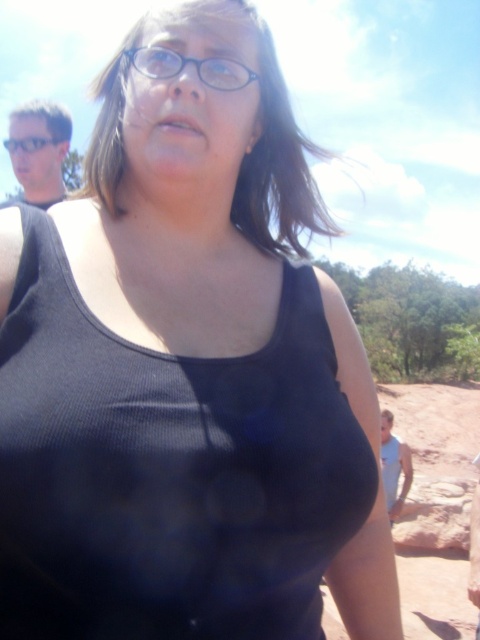
Question: Where is black plastic glasses at center located in relation to black plastic glasses at upper center in the image?

Choices:
 (A) above
 (B) below

Answer: (B)

Question: Which point is closer to the camera?

Choices:
 (A) black plastic glasses at center
 (B) black plastic glasses at upper center

Answer: (A)

Question: Among these objects, which one is farthest from the camera?

Choices:
 (A) black plastic glasses at upper center
 (B) black plastic glasses at center

Answer: (A)

Question: In this image, where is black plastic glasses at center located relative to black plastic glasses at upper center?

Choices:
 (A) above
 (B) below

Answer: (B)

Question: Is black plastic glasses at center to the left of black plastic glasses at upper center from the viewer's perspective?

Choices:
 (A) no
 (B) yes

Answer: (A)